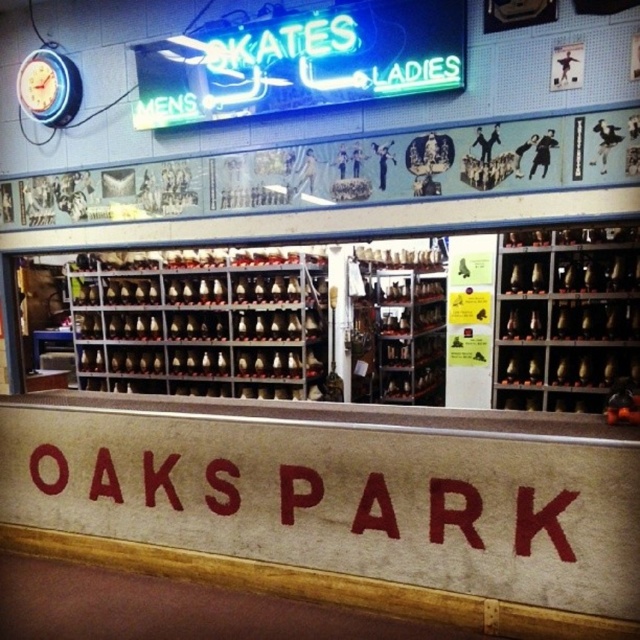
Is metallic silver skates at center thinner than metallic gold skates at right?

In fact, metallic silver skates at center might be wider than metallic gold skates at right.

Is metallic silver skates at center shorter than metallic gold skates at right?

In fact, metallic silver skates at center may be taller than metallic gold skates at right.

What do you see at coordinates (200, 323) in the screenshot? I see `metallic silver skates at center` at bounding box center [200, 323].

Locate an element on the screen. metallic silver skates at center is located at coordinates (200, 323).

Looking at this image, can you confirm if red painted sign at center is positioned to the right of neon green sign at upper center?

Incorrect, red painted sign at center is not on the right side of neon green sign at upper center.

Does red painted sign at center have a greater width compared to neon green sign at upper center?

Yes, red painted sign at center is wider than neon green sign at upper center.

What are the coordinates of `red painted sign at center` in the screenshot? It's located at (268, 497).

Which is below, neon green sign at upper center or metallic gold skates at right?

metallic gold skates at right is lower down.

Which is more to the right, neon green sign at upper center or metallic gold skates at right?

Positioned to the right is metallic gold skates at right.

Is point (138, 116) less distant than point (499, 326)?

Yes, it is.

I want to click on neon green sign at upper center, so click(301, 61).